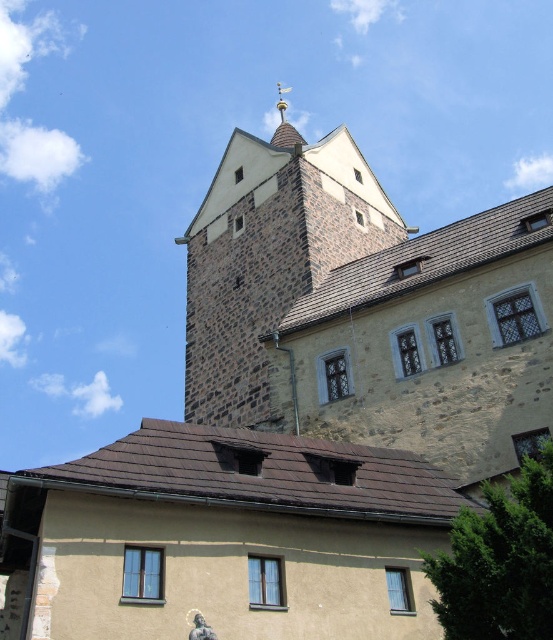
Question: Which object appears farthest from the camera in this image?

Choices:
 (A) rustic stone tower at upper center
 (B) gold spire at upper center

Answer: (B)

Question: Can you confirm if rustic stone tower at upper center is positioned to the left of gold spire at upper center?

Choices:
 (A) yes
 (B) no

Answer: (A)

Question: Which object is closer to the camera taking this photo?

Choices:
 (A) gold spire at upper center
 (B) rustic stone tower at upper center

Answer: (B)

Question: Can you confirm if rustic stone tower at upper center is positioned to the right of gold spire at upper center?

Choices:
 (A) yes
 (B) no

Answer: (B)

Question: Is the position of rustic stone tower at upper center more distant than that of gold spire at upper center?

Choices:
 (A) no
 (B) yes

Answer: (A)